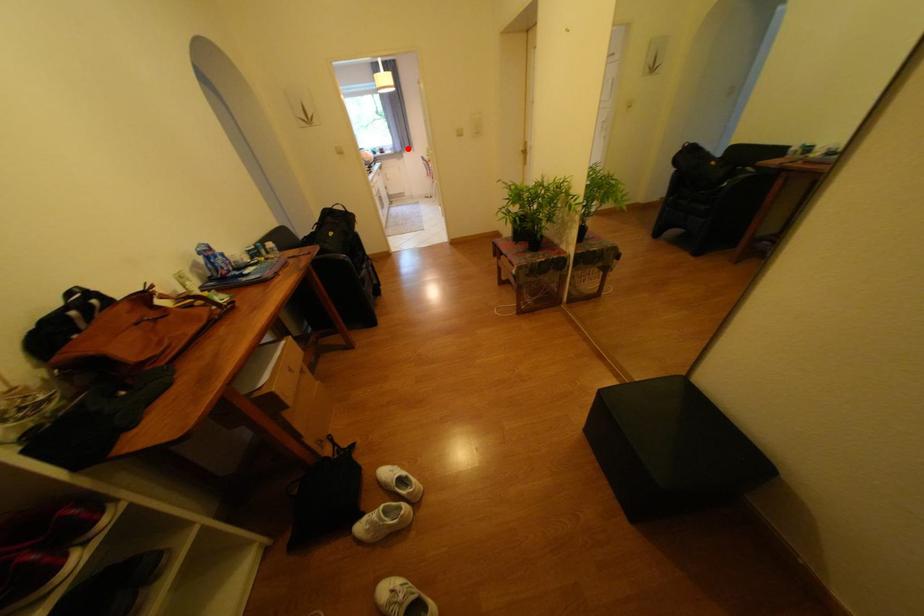
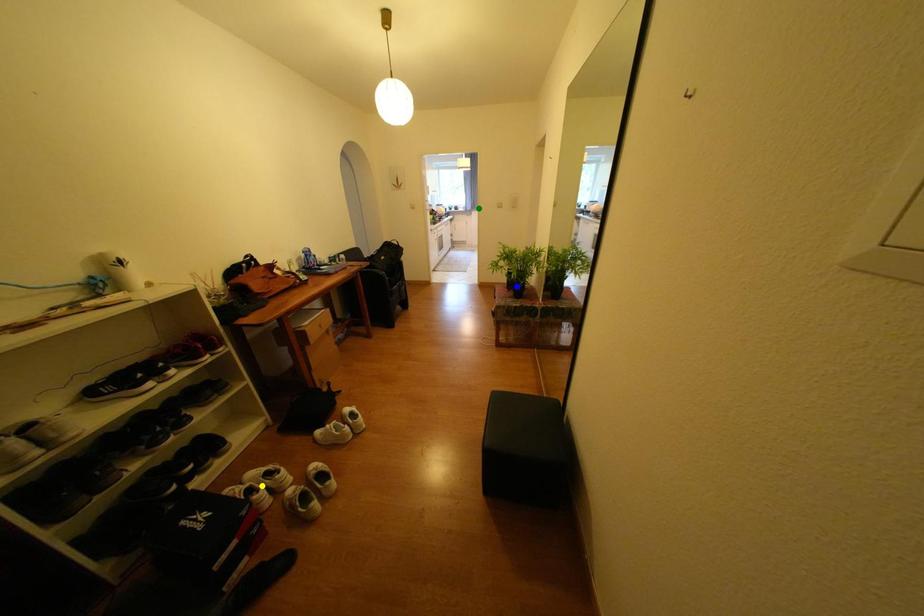
Question: I am providing you with two images of the same scene from different viewpoints. A red point is marked on the first image. You are given multiple points on the second image. Which mark in image 2 goes with the point in image 1?

Choices:
 (A) green point
 (B) yellow point
 (C) blue point

Answer: (A)